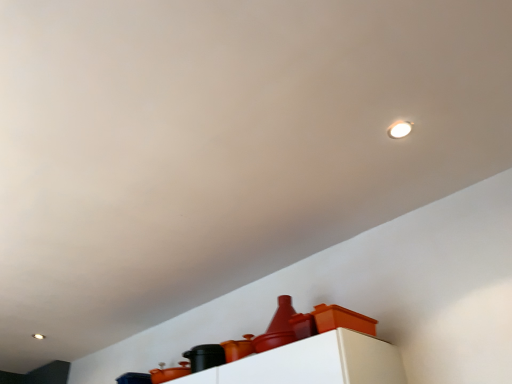
Describe the element at coordinates (399, 129) in the screenshot. The image size is (512, 384). I see `white glossy light at upper right` at that location.

In order to face white glossy light at upper right, should I rotate leftwards or rightwards?

To align with it, rotate right about 18.795°.

You are a GUI agent. You are given a task and a screenshot of the screen. Output one action in this format:
    pyautogui.click(x=<x>, y=<y>)
    Task: Click on the white glossy light at upper right
    The width and height of the screenshot is (512, 384).
    Given the screenshot: What is the action you would take?
    pyautogui.click(x=399, y=129)

You are a GUI agent. You are given a task and a screenshot of the screen. Output one action in this format:
    pyautogui.click(x=<x>, y=<y>)
    Task: Click on the white glossy light at upper right
    
    Given the screenshot: What is the action you would take?
    pyautogui.click(x=399, y=129)